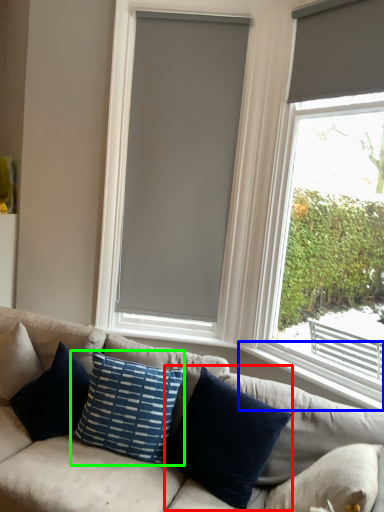
Question: Based on their relative distances, which object is nearer to pillow (highlighted by a red box)? Choose from window sill (highlighted by a blue box) and pillow (highlighted by a green box).

Choices:
 (A) window sill
 (B) pillow

Answer: (B)